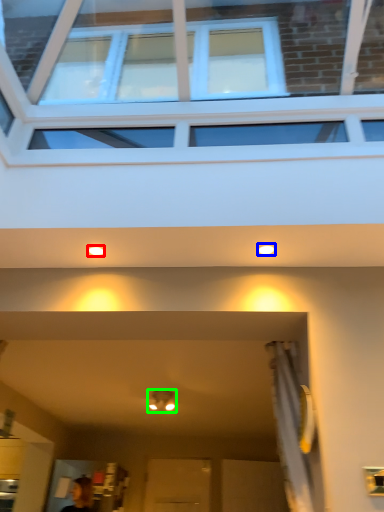
Question: Considering the real-world distances, which object is farthest from lighting (highlighted by a red box)? lighting (highlighted by a blue box) or light fixture (highlighted by a green box)?

Choices:
 (A) lighting
 (B) light fixture

Answer: (B)